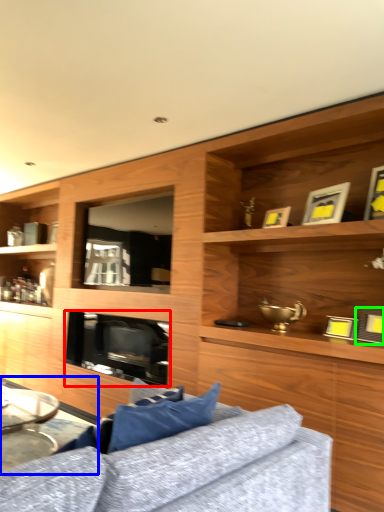
Question: Which object is the closest to the fireplace (highlighted by a red box)? Choose among these: table (highlighted by a blue box) or picture frame (highlighted by a green box).

Choices:
 (A) table
 (B) picture frame

Answer: (A)